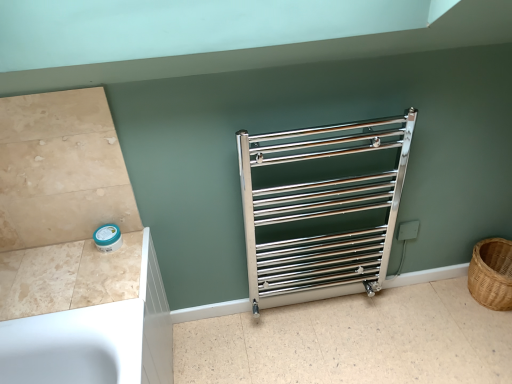
The image size is (512, 384). Describe the element at coordinates (68, 277) in the screenshot. I see `beige marble counter top at lower left` at that location.

Describe the element at coordinates (353, 341) in the screenshot. This screenshot has height=384, width=512. I see `metallic silver towel rack at center` at that location.

At what (x,y) coordinates should I click in order to perform the action: click on polished chrome towel rack at center. Please return your answer as a coordinate pair (x, y). The height and width of the screenshot is (384, 512). Looking at the image, I should click on (322, 211).

Locate an element on the screen. The image size is (512, 384). beige marble counter top at lower left is located at coordinates (68, 277).

Which object is positioned more to the right, brown woven basket at right or beige marble counter top at lower left?

From the viewer's perspective, brown woven basket at right appears more on the right side.

Is brown woven basket at right in contact with beige marble counter top at lower left?

There is a gap between brown woven basket at right and beige marble counter top at lower left.

Consider the image. Who is smaller, brown woven basket at right or beige marble counter top at lower left?

With smaller size is beige marble counter top at lower left.

Considering the sizes of objects brown woven basket at right and beige marble counter top at lower left in the image provided, who is taller, brown woven basket at right or beige marble counter top at lower left?

brown woven basket at right.

Considering the points (381, 229) and (475, 295), which point is in front, point (381, 229) or point (475, 295)?

The point (381, 229) is more forward.

Is polished chrome towel rack at center bigger than brown woven basket at right?

Yes, polished chrome towel rack at center is bigger than brown woven basket at right.

Considering the relative sizes of polished chrome towel rack at center and brown woven basket at right in the image provided, is polished chrome towel rack at center thinner than brown woven basket at right?

Yes, polished chrome towel rack at center is thinner than brown woven basket at right.

Is metallic silver towel rack at center shorter than beige marble counter top at lower left?

In fact, metallic silver towel rack at center may be taller than beige marble counter top at lower left.

Can you tell me how much metallic silver towel rack at center and beige marble counter top at lower left differ in facing direction?

The angular difference between metallic silver towel rack at center and beige marble counter top at lower left is 89.1 degrees.

Image resolution: width=512 pixels, height=384 pixels. In the image, there is a beige marble counter top at lower left. What are the coordinates of `tile below it (from a real-world perspective)` in the screenshot? It's located at (353, 341).

Consider the image. Would you say beige marble counter top at lower left is inside or outside polished chrome towel rack at center?

beige marble counter top at lower left exists outside the volume of polished chrome towel rack at center.

Relative to polished chrome towel rack at center, is beige marble counter top at lower left in front or behind?

Visually, beige marble counter top at lower left is located in front of polished chrome towel rack at center.

Considering the relative sizes of beige marble counter top at lower left and polished chrome towel rack at center in the image provided, is beige marble counter top at lower left shorter than polished chrome towel rack at center?

Indeed, beige marble counter top at lower left has a lesser height compared to polished chrome towel rack at center.

From the image's perspective, which is above, beige marble counter top at lower left or polished chrome towel rack at center?

polished chrome towel rack at center appears higher in the image.

Looking at the image, does brown woven basket at right seem bigger or smaller compared to polished chrome towel rack at center?

In the image, brown woven basket at right appears to be smaller than polished chrome towel rack at center.

Does brown woven basket at right have a greater width compared to polished chrome towel rack at center?

Indeed, brown woven basket at right has a greater width compared to polished chrome towel rack at center.

Is brown woven basket at right taller than polished chrome towel rack at center?

No.

Considering the relative sizes of brown woven basket at right and metallic silver towel rack at center in the image provided, is brown woven basket at right taller than metallic silver towel rack at center?

Yes.

The height and width of the screenshot is (384, 512). I want to click on tile on the left side of brown woven basket at right, so click(353, 341).

Looking at this image, considering the relative sizes of brown woven basket at right and metallic silver towel rack at center in the image provided, is brown woven basket at right wider than metallic silver towel rack at center?

No.

Between brown woven basket at right and metallic silver towel rack at center, which one has larger size?

metallic silver towel rack at center.

Which of these two, beige marble counter top at lower left or metallic silver towel rack at center, is bigger?

metallic silver towel rack at center.

From a real-world perspective, which object rests below the other?

metallic silver towel rack at center is physically lower.

Based on the photo, in the image, is beige marble counter top at lower left positioned in front of or behind metallic silver towel rack at center?

Visually, beige marble counter top at lower left is located in front of metallic silver towel rack at center.

This screenshot has width=512, height=384. Identify the location of basket below the beige marble counter top at lower left (from the image's perspective). (490, 274).

Identify the location of cage on the left of brown woven basket at right. (322, 211).

Which object lies nearer to the anchor point beige marble counter top at lower left, metallic silver towel rack at center or polished chrome towel rack at center?

Among the two, polished chrome towel rack at center is located nearer to beige marble counter top at lower left.

Which object lies further to the anchor point brown woven basket at right, beige marble counter top at lower left or metallic silver towel rack at center?

Among the two, beige marble counter top at lower left is located further to brown woven basket at right.

When comparing their distances from beige marble counter top at lower left, does brown woven basket at right or polished chrome towel rack at center seem further?

brown woven basket at right.

Looking at the image, which one is located further to metallic silver towel rack at center, brown woven basket at right or beige marble counter top at lower left?

beige marble counter top at lower left is positioned further to the anchor metallic silver towel rack at center.

Which object lies nearer to the anchor point brown woven basket at right, polished chrome towel rack at center or beige marble counter top at lower left?

polished chrome towel rack at center is positioned closer to the anchor brown woven basket at right.

Based on their spatial positions, is beige marble counter top at lower left or metallic silver towel rack at center closer to polished chrome towel rack at center?

metallic silver towel rack at center lies closer to polished chrome towel rack at center than the other object.

In the scene shown: Considering their positions, is polished chrome towel rack at center positioned further to brown woven basket at right than metallic silver towel rack at center?

polished chrome towel rack at center lies further to brown woven basket at right than the other object.

Which object lies further to the anchor point polished chrome towel rack at center, beige marble counter top at lower left or brown woven basket at right?

beige marble counter top at lower left is further to polished chrome towel rack at center.

Find the location of a particular element. The width and height of the screenshot is (512, 384). tile between polished chrome towel rack at center and brown woven basket at right from left to right is located at coordinates (353, 341).

Find the location of `cage located between beige marble counter top at lower left and metallic silver towel rack at center in the left-right direction`. cage located between beige marble counter top at lower left and metallic silver towel rack at center in the left-right direction is located at coordinates (322, 211).

Find the location of a particular element. The height and width of the screenshot is (384, 512). tile between beige marble counter top at lower left and brown woven basket at right from left to right is located at coordinates (353, 341).

Locate an element on the screen. This screenshot has width=512, height=384. cage located between beige marble counter top at lower left and brown woven basket at right in the left-right direction is located at coordinates (322, 211).